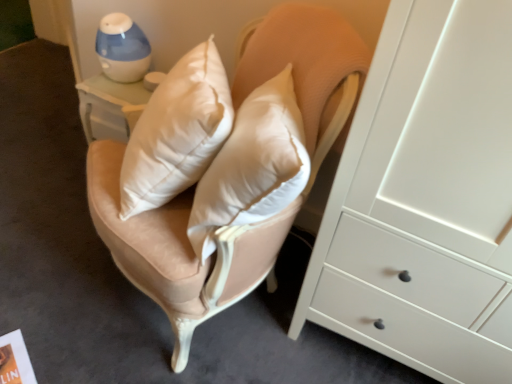
Question: Is satin beige swivel chair at center bigger than blue plastic humidifier at upper left?

Choices:
 (A) yes
 (B) no

Answer: (A)

Question: Could you tell me if satin beige swivel chair at center is turned towards blue plastic humidifier at upper left?

Choices:
 (A) no
 (B) yes

Answer: (A)

Question: Is satin beige swivel chair at center outside of blue plastic humidifier at upper left?

Choices:
 (A) yes
 (B) no

Answer: (A)

Question: Considering the relative sizes of satin beige swivel chair at center and blue plastic humidifier at upper left in the image provided, is satin beige swivel chair at center smaller than blue plastic humidifier at upper left?

Choices:
 (A) yes
 (B) no

Answer: (B)

Question: Is satin beige swivel chair at center not near blue plastic humidifier at upper left?

Choices:
 (A) yes
 (B) no

Answer: (B)

Question: From the image's perspective, is satin beige swivel chair at center above blue plastic humidifier at upper left?

Choices:
 (A) no
 (B) yes

Answer: (A)

Question: Are blue plastic humidifier at upper left and satin beige swivel chair at center beside each other?

Choices:
 (A) no
 (B) yes

Answer: (A)

Question: Is blue plastic humidifier at upper left facing away from satin beige swivel chair at center?

Choices:
 (A) no
 (B) yes

Answer: (A)

Question: From the image's perspective, does blue plastic humidifier at upper left appear lower than satin beige swivel chair at center?

Choices:
 (A) no
 (B) yes

Answer: (A)

Question: Is blue plastic humidifier at upper left at the right side of satin beige swivel chair at center?

Choices:
 (A) yes
 (B) no

Answer: (B)

Question: From a real-world perspective, is blue plastic humidifier at upper left on top of satin beige swivel chair at center?

Choices:
 (A) no
 (B) yes

Answer: (B)

Question: Considering the relative positions of blue plastic humidifier at upper left and satin beige swivel chair at center in the image provided, is blue plastic humidifier at upper left in front of satin beige swivel chair at center?

Choices:
 (A) no
 (B) yes

Answer: (A)

Question: In terms of height, does blue plastic humidifier at upper left look taller or shorter compared to satin beige swivel chair at center?

Choices:
 (A) short
 (B) tall

Answer: (A)